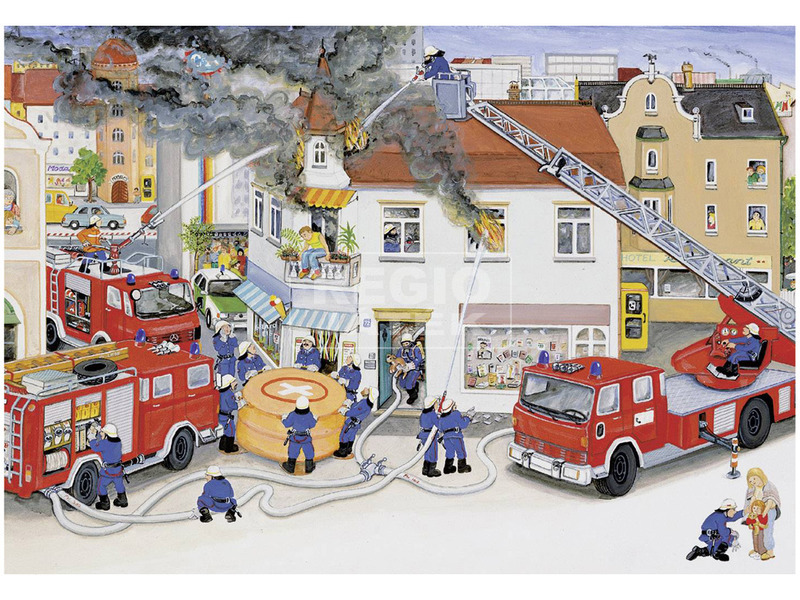
Locate an element on the screen. This screenshot has width=800, height=600. ladder is located at coordinates (50, 360).